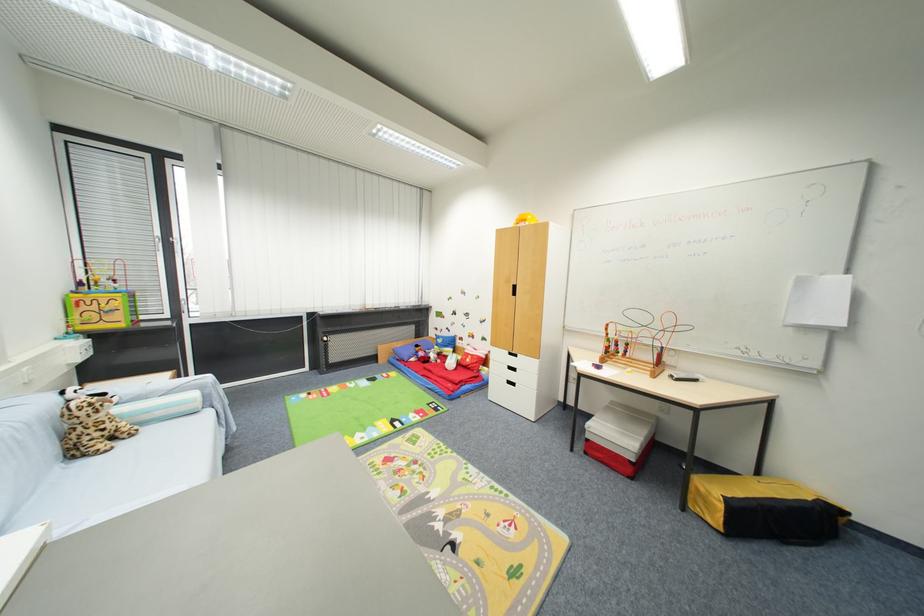
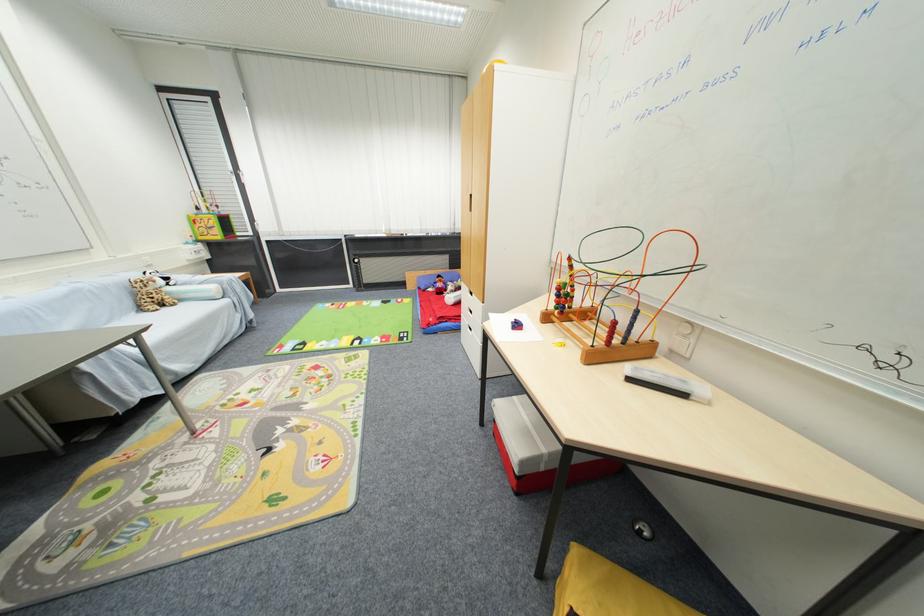
Where in the second image is the point corresponding to point (613, 326) from the first image?

(575, 261)